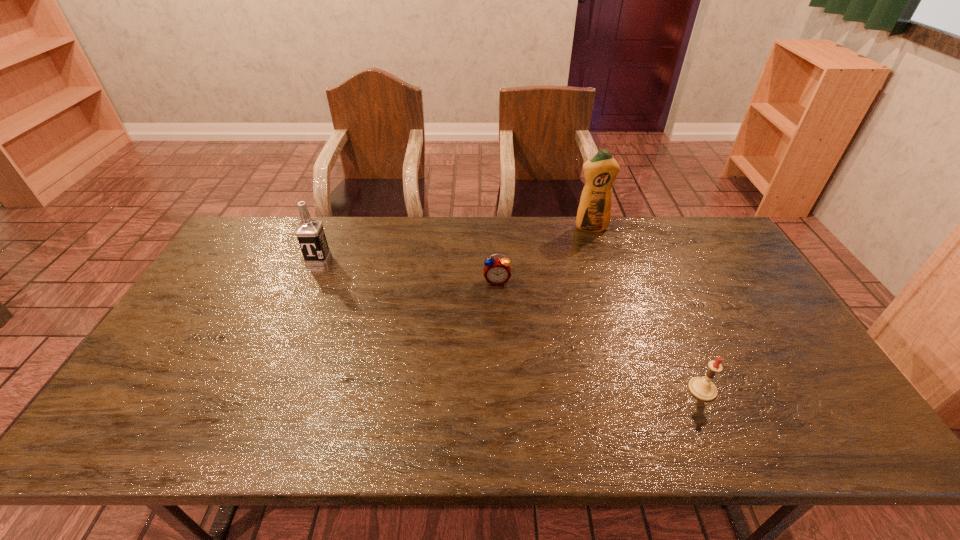
At what (x,y) coordinates should I click in order to perform the action: click on vacant area that lies between the third nearest object and the third farthest object. Please return your answer as a coordinate pair (x, y). The image size is (960, 540). Looking at the image, I should click on (408, 270).

The width and height of the screenshot is (960, 540). Find the location of `vacant space that is in between the farthest object and the nearest object`. vacant space that is in between the farthest object and the nearest object is located at coordinates (646, 308).

Locate an element on the screen. This screenshot has width=960, height=540. free space that is in between the leftmost object and the second object from left to right is located at coordinates (408, 270).

This screenshot has height=540, width=960. Find the location of `vacant region between the vodka and the detergent`. vacant region between the vodka and the detergent is located at coordinates (454, 244).

Find the location of a particular element. This screenshot has height=540, width=960. free space between the rightmost object and the third object from right to left is located at coordinates (600, 335).

The image size is (960, 540). What are the coordinates of `free space between the detergent and the second farthest object` in the screenshot? It's located at (454, 244).

Find the location of a particular element. empty space that is in between the alarm clock and the rightmost object is located at coordinates (600, 335).

Locate which object is the third closest to the candle. Please provide its 2D coordinates. Your answer should be formatted as a tuple, i.e. [(x, y)], where the tuple contains the x and y coordinates of a point satisfying the conditions above.

[(310, 233)]

Identify which object is the closest to the leftmost object. Please provide its 2D coordinates. Your answer should be formatted as a tuple, i.e. [(x, y)], where the tuple contains the x and y coordinates of a point satisfying the conditions above.

[(497, 271)]

Locate an element on the screen. free spot that satisfies the following two spatial constraints: 1. on the label of the tallest object; 2. on the left side of the nearest object is located at coordinates pyautogui.click(x=641, y=389).